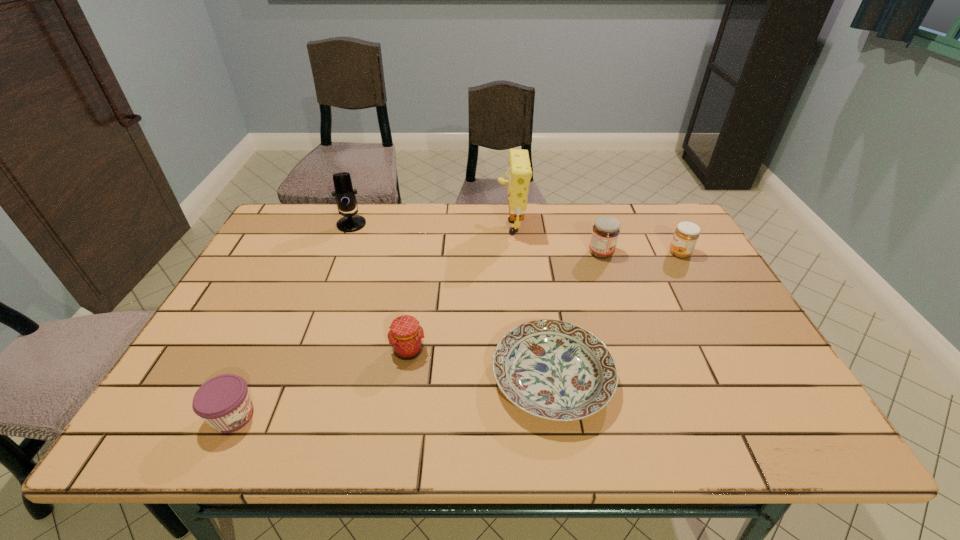
Identify the location of blank space at the far left corner. The height and width of the screenshot is (540, 960). (331, 205).

Identify the location of vacant space at the far right corner of the desktop. (644, 212).

Where is `vacant region between the sixth object from left to right and the second nearest jam`? The width and height of the screenshot is (960, 540). vacant region between the sixth object from left to right and the second nearest jam is located at coordinates (505, 302).

Image resolution: width=960 pixels, height=540 pixels. I want to click on free space between the sixth shortest object and the fifth object from right to left, so click(380, 287).

The height and width of the screenshot is (540, 960). In order to click on free space between the third jam from left to right and the tallest object in this screenshot , I will do `click(556, 238)`.

The height and width of the screenshot is (540, 960). What are the coordinates of `vacant area between the second nearest jam and the shortest object` in the screenshot? It's located at (480, 364).

Where is `vacant point located between the microphone and the third jam from left to right`? This screenshot has height=540, width=960. vacant point located between the microphone and the third jam from left to right is located at coordinates (476, 239).

I want to click on vacant region between the second object from right to left and the plate, so click(577, 315).

Identify the location of empty space that is in between the third jam from right to left and the plate. The image size is (960, 540). (480, 364).

Locate an element on the screen. free spot between the rightmost object and the microphone is located at coordinates (516, 239).